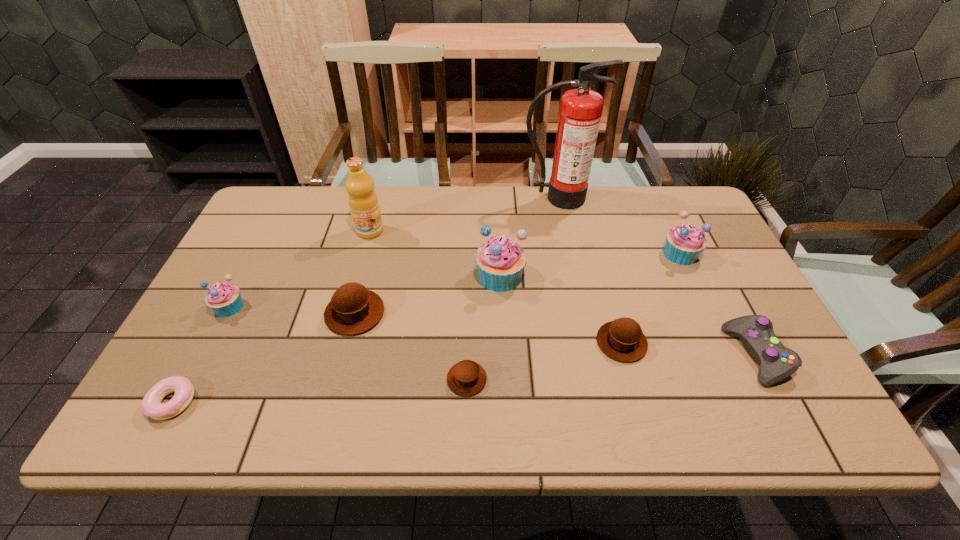
Find the location of a particular element. fruit juice that is at the far edge is located at coordinates (363, 201).

I want to click on muffin at the near edge, so click(x=466, y=378).

The width and height of the screenshot is (960, 540). I want to click on doughnut that is at the near edge, so click(x=151, y=405).

The image size is (960, 540). In order to click on muffin located at the left edge in this screenshot , I will do `click(225, 300)`.

You are a GUI agent. You are given a task and a screenshot of the screen. Output one action in this format:
    pyautogui.click(x=<x>, y=<y>)
    Task: Click on the doughnut positioned at the left edge
    This screenshot has width=960, height=540.
    Given the screenshot: What is the action you would take?
    pyautogui.click(x=151, y=405)

Image resolution: width=960 pixels, height=540 pixels. I want to click on muffin that is at the right edge, so click(684, 243).

Where is `control present at the right edge`? The height and width of the screenshot is (540, 960). control present at the right edge is located at coordinates (756, 333).

Locate an element on the screen. object located in the near left corner section of the desktop is located at coordinates (151, 405).

Locate an element on the screen. vacant space at the far edge is located at coordinates (401, 193).

In the image, there is a desktop. At what (x,y) coordinates should I click in order to perform the action: click on vacant space at the near edge. Please return your answer as a coordinate pair (x, y). This screenshot has height=540, width=960. Looking at the image, I should click on (670, 426).